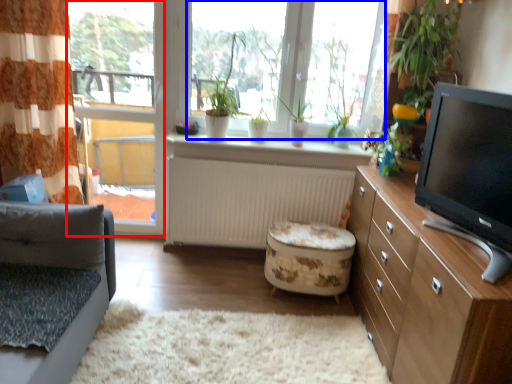
Question: Among these objects, which one is nearest to the camera, window frame (highlighted by a red box) or bay window (highlighted by a blue box)?

Choices:
 (A) window frame
 (B) bay window

Answer: (B)